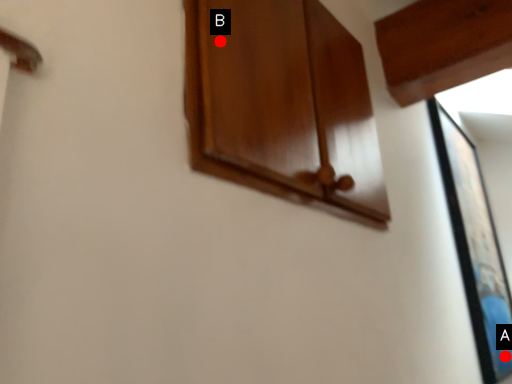
Question: Two points are circled on the image, labeled by A and B beside each circle. Which point is farther to the camera?

Choices:
 (A) A is further
 (B) B is further

Answer: (A)